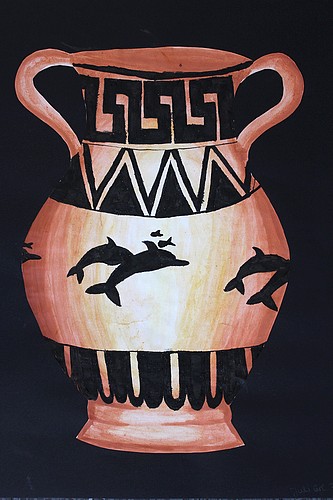
Find the location of a particular element. The width and height of the screenshot is (333, 500). left handle is located at coordinates (26, 91).